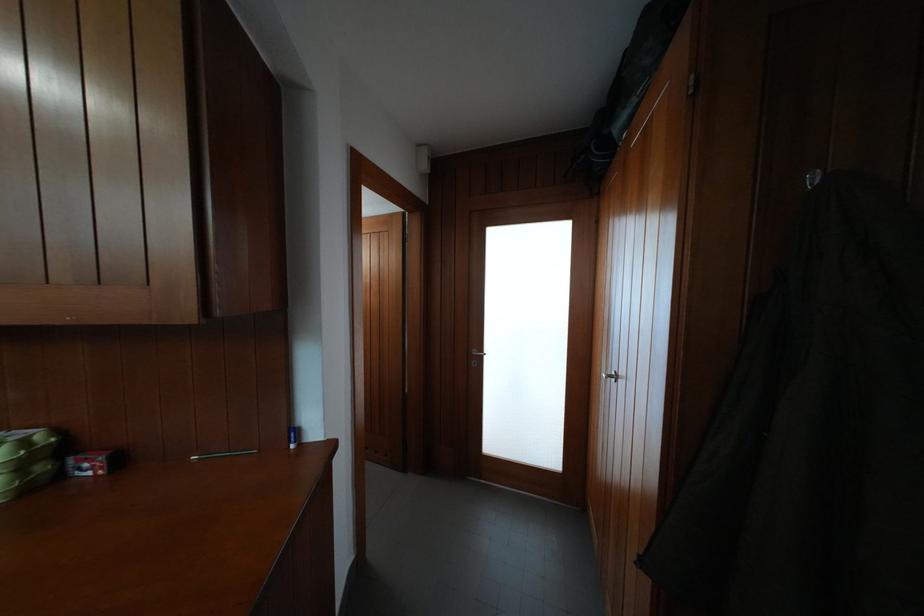
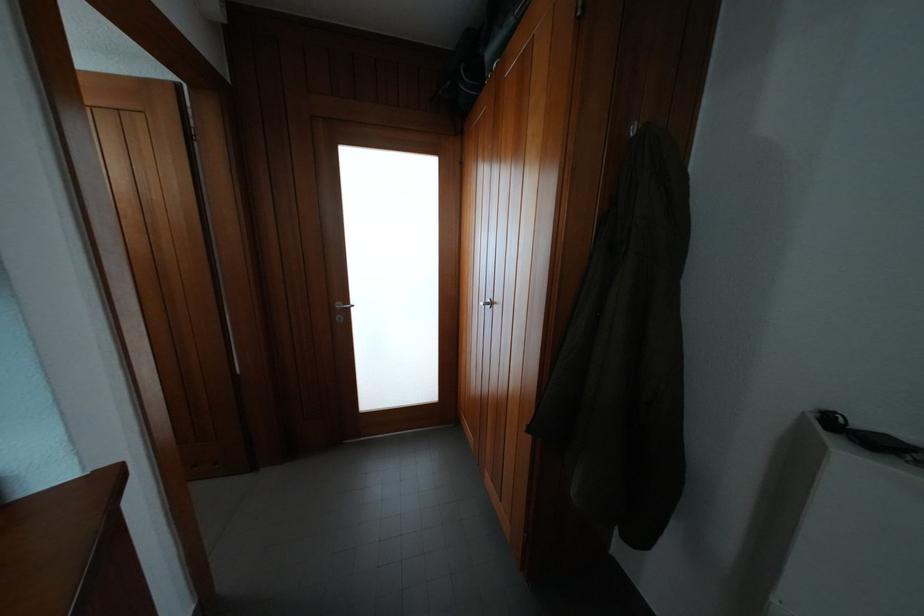
Question: Based on the continuous images, in which direction is the camera rotating? Reply with the corresponding letter.

Choices:
 (A) Left
 (B) Right
 (C) Up
 (D) Down

Answer: (B)